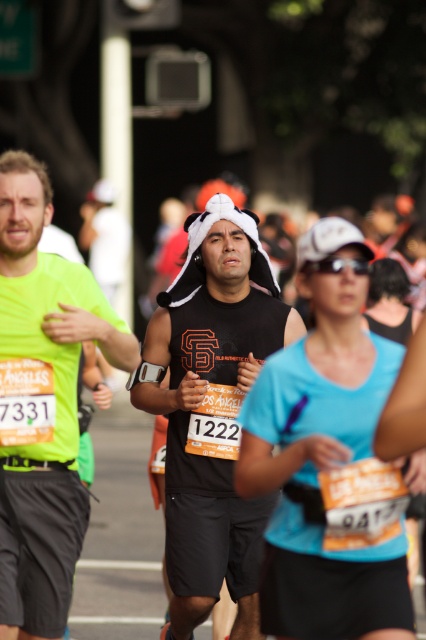
Is matte black tank top at center thinner than black matte tank top at center?

Yes.

Between point (377, 410) and point (198, 266), which one is positioned behind?

The point (198, 266) is behind.

Find the location of a particular element. The image size is (426, 640). matte black tank top at center is located at coordinates (327, 460).

At what (x,y) coordinates should I click in order to perform the action: click on matte black tank top at center. Please return your answer as a coordinate pair (x, y). The width and height of the screenshot is (426, 640). Looking at the image, I should click on (327, 460).

Between matte black tank top at center and neon green fabric shirt at left, which one appears on the right side from the viewer's perspective?

From the viewer's perspective, matte black tank top at center appears more on the right side.

How far apart are matte black tank top at center and neon green fabric shirt at left?

The distance of matte black tank top at center from neon green fabric shirt at left is 1.28 meters.

Which is in front, point (262, 454) or point (121, 365)?

Point (262, 454) is more forward.

Where is `matte black tank top at center`? The image size is (426, 640). matte black tank top at center is located at coordinates (327, 460).

Which is more to the right, black matte tank top at center or neon green fabric shirt at left?

black matte tank top at center

Is black matte tank top at center shorter than neon green fabric shirt at left?

No, black matte tank top at center is not shorter than neon green fabric shirt at left.

Measure the distance between point [242,268] and camera.

They are 5.85 meters apart.

Find the location of a particular element. The height and width of the screenshot is (640, 426). black matte tank top at center is located at coordinates (212, 410).